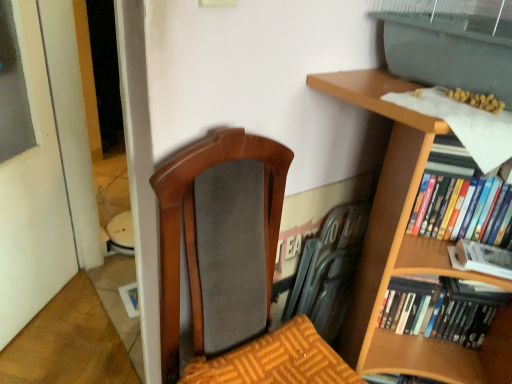
Question: Is hardcover books at right, which is the third book in bottom-to-top order, turned away from matte black swivel chair at center?

Choices:
 (A) yes
 (B) no

Answer: (B)

Question: Is the depth of hardcover books at right, positioned as the first book in top-to-bottom order, less than that of matte black swivel chair at center?

Choices:
 (A) yes
 (B) no

Answer: (A)

Question: Is hardcover books at right, positioned as the first book in top-to-bottom order, next to matte black swivel chair at center?

Choices:
 (A) no
 (B) yes

Answer: (A)

Question: Does hardcover books at right, which is the third book in bottom-to-top order, appear on the right side of matte black swivel chair at center?

Choices:
 (A) no
 (B) yes

Answer: (B)

Question: Considering the relative sizes of hardcover books at right, positioned as the first book in top-to-bottom order, and matte black swivel chair at center in the image provided, is hardcover books at right, positioned as the first book in top-to-bottom order, shorter than matte black swivel chair at center?

Choices:
 (A) no
 (B) yes

Answer: (B)

Question: From the image's perspective, is matte black swivel chair at center positioned above or below white matte book at right, the second book ordered from the bottom?

Choices:
 (A) below
 (B) above

Answer: (B)

Question: Considering the positions of matte black swivel chair at center and white matte book at right, positioned as the second book in top-to-bottom order, in the image, is matte black swivel chair at center wider or thinner than white matte book at right, positioned as the second book in top-to-bottom order,?

Choices:
 (A) wide
 (B) thin

Answer: (B)

Question: Considering the positions of matte black swivel chair at center and white matte book at right, positioned as the second book in top-to-bottom order, in the image, is matte black swivel chair at center taller or shorter than white matte book at right, positioned as the second book in top-to-bottom order,?

Choices:
 (A) short
 (B) tall

Answer: (B)

Question: Is matte black swivel chair at center inside or outside of white matte book at right, positioned as the second book in top-to-bottom order?

Choices:
 (A) inside
 (B) outside

Answer: (B)

Question: Is point (483, 273) closer or farther from the camera than point (402, 304)?

Choices:
 (A) closer
 (B) farther

Answer: (A)

Question: Is white matte book at right, positioned as the second book in top-to-bottom order, spatially inside hardcover books at right, marked as the third book in a top-to-bottom arrangement, or outside of it?

Choices:
 (A) outside
 (B) inside

Answer: (A)

Question: Considering the positions of white matte book at right, the second book ordered from the bottom, and hardcover books at right, acting as the first book starting from the bottom, in the image, is white matte book at right, the second book ordered from the bottom, wider or thinner than hardcover books at right, acting as the first book starting from the bottom,?

Choices:
 (A) wide
 (B) thin

Answer: (B)

Question: In the image, is white matte book at right, positioned as the second book in top-to-bottom order, positioned in front of or behind hardcover books at right, acting as the first book starting from the bottom?

Choices:
 (A) behind
 (B) front

Answer: (B)

Question: Is white matte book at right, the second book ordered from the bottom, bigger or smaller than matte black swivel chair at center?

Choices:
 (A) big
 (B) small

Answer: (B)

Question: From a real-world perspective, relative to matte black swivel chair at center, is white matte book at right, the second book ordered from the bottom, vertically above or below?

Choices:
 (A) below
 (B) above

Answer: (B)